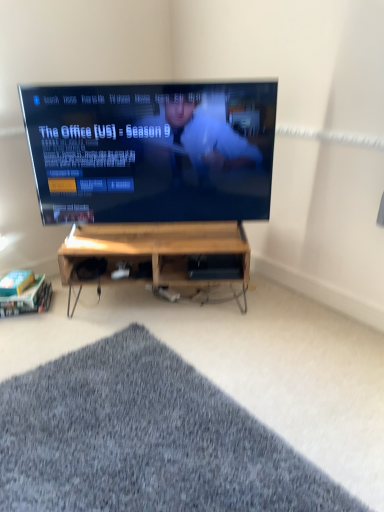
You are a GUI agent. You are given a task and a screenshot of the screen. Output one action in this format:
    pyautogui.click(x=<x>, y=<y>)
    Task: Click on the space that is in front of woodenmaterial/textureshelf at lower left, positioned as the 2th shelf in right-to-left order
    Image resolution: width=384 pixels, height=512 pixels.
    Given the screenshot: What is the action you would take?
    pyautogui.click(x=23, y=326)